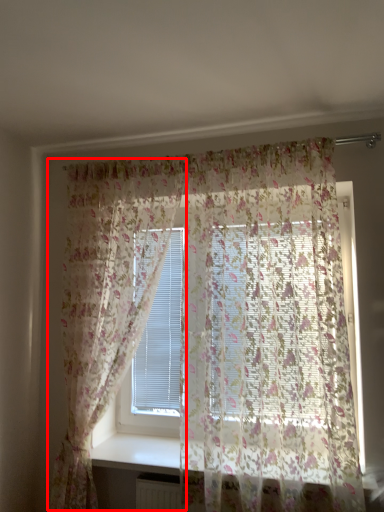
Question: Observing the image, what is the correct spatial positioning of curtain (annotated by the red box) in reference to curtain?

Choices:
 (A) left
 (B) right

Answer: (A)